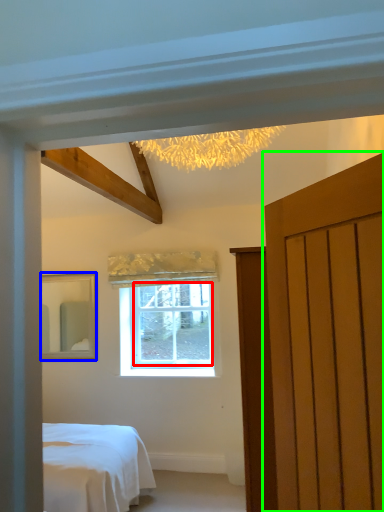
Question: Considering the real-world distances, which object is farthest from window screen (highlighted by a red box)? mirror (highlighted by a blue box) or door (highlighted by a green box)?

Choices:
 (A) mirror
 (B) door

Answer: (B)